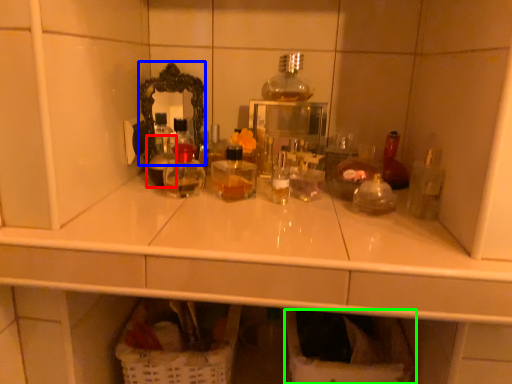
Question: Considering the real-world distances, which object is farthest from bottle (highlighted by a red box)? mirror (highlighted by a blue box) or laundry basket (highlighted by a green box)?

Choices:
 (A) mirror
 (B) laundry basket

Answer: (B)